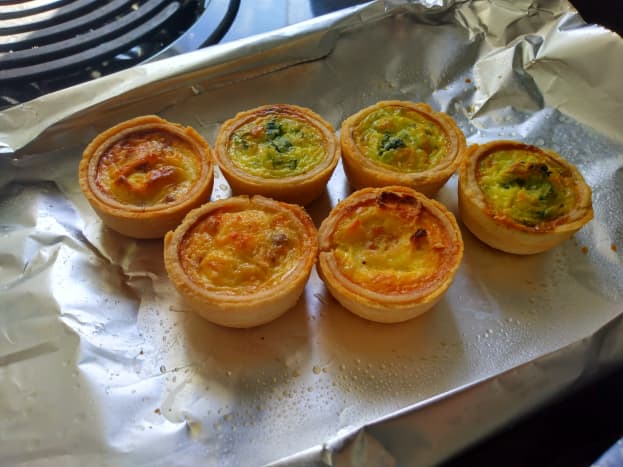
Locate an element on the screen. This screenshot has height=467, width=623. stove burner is located at coordinates pos(121,23).